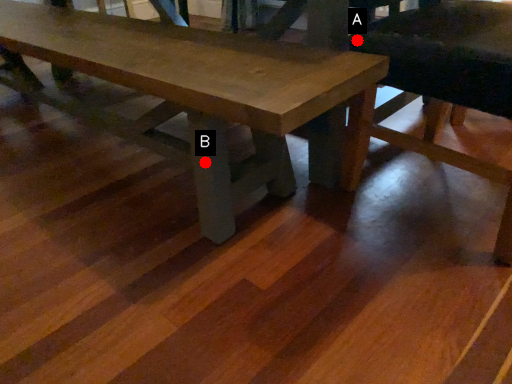
Question: Two points are circled on the image, labeled by A and B beside each circle. Which point appears closest to the camera in this image?

Choices:
 (A) A is closer
 (B) B is closer

Answer: (B)